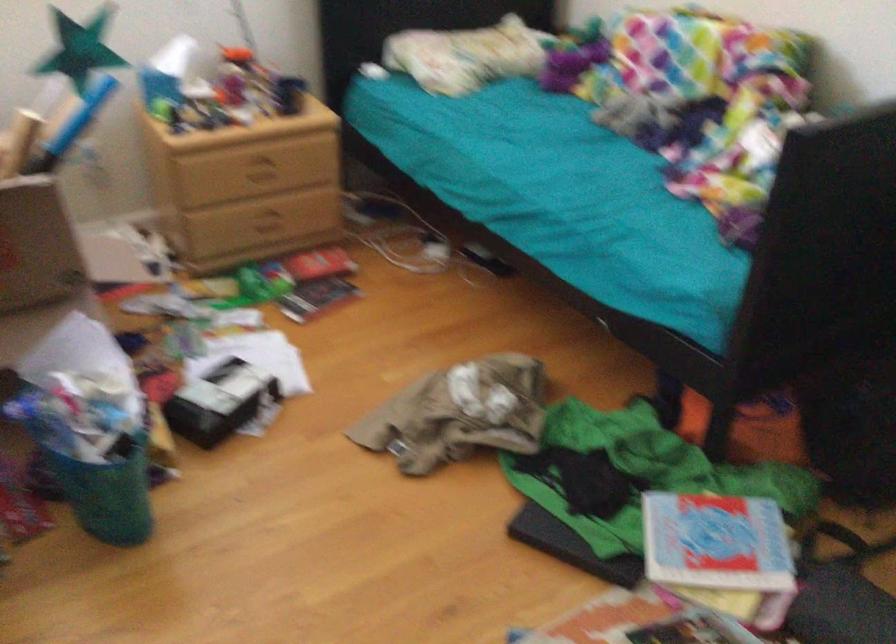
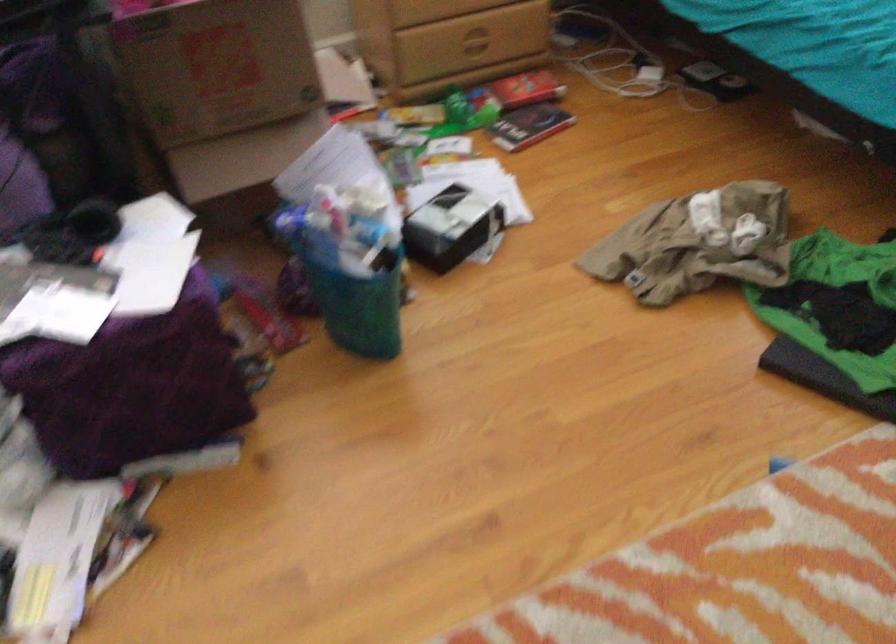
Where in the second image is the point corresponding to point (220, 401) from the first image?

(451, 227)